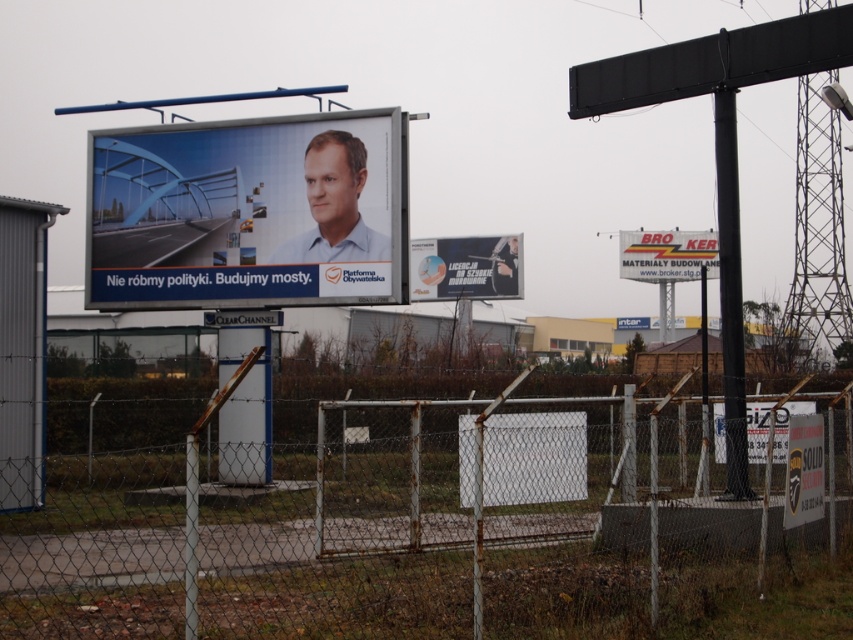
Question: Is the position of rusty chain-link fence at lower center more distant than that of matte plastic billboard at center?

Choices:
 (A) no
 (B) yes

Answer: (A)

Question: Is matte plastic billboard at center closer to the viewer compared to white plastic sign at upper center?

Choices:
 (A) no
 (B) yes

Answer: (B)

Question: Which of the following is the closest to the observer?

Choices:
 (A) (473, 284)
 (B) (173, 209)

Answer: (B)

Question: Which object is farther from the camera taking this photo?

Choices:
 (A) white plastic sign at upper center
 (B) rusty chain-link fence at lower center
 (C) black glossy poster at center
 (D) matte plastic billboard at center

Answer: (A)

Question: Is the position of rusty chain-link fence at lower center less distant than that of matte plastic billboard at center?

Choices:
 (A) yes
 (B) no

Answer: (A)

Question: Among these points, which one is nearest to the camera?

Choices:
 (A) (194, 454)
 (B) (250, 205)

Answer: (A)